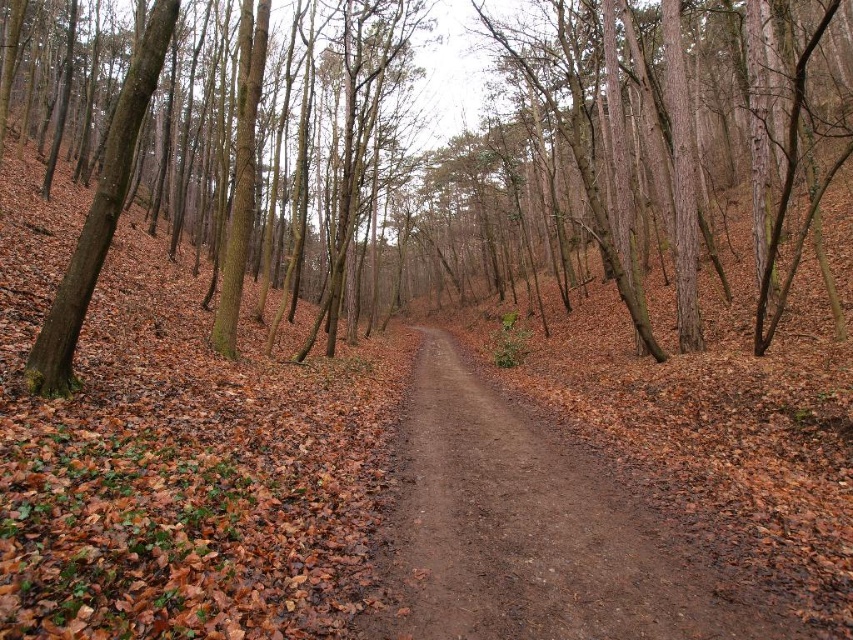
Question: Which object appears closest to the camera in this image?

Choices:
 (A) brown rough tree at left
 (B) brown bark tree at center
 (C) brown dirt trail at center

Answer: (C)

Question: Which of the following is the farthest from the observer?

Choices:
 (A) (668, 67)
 (B) (451, 554)

Answer: (A)

Question: Which of these objects is positioned farthest from the brown bark tree at center?

Choices:
 (A) brown dirt trail at center
 (B) brown rough tree at left

Answer: (A)

Question: Does brown bark tree at center have a lesser width compared to brown dirt trail at center?

Choices:
 (A) yes
 (B) no

Answer: (B)

Question: Where is brown dirt trail at center located in relation to brown rough tree at left in the image?

Choices:
 (A) left
 (B) right

Answer: (B)

Question: In this image, where is brown bark tree at center located relative to brown rough tree at left?

Choices:
 (A) left
 (B) right

Answer: (B)